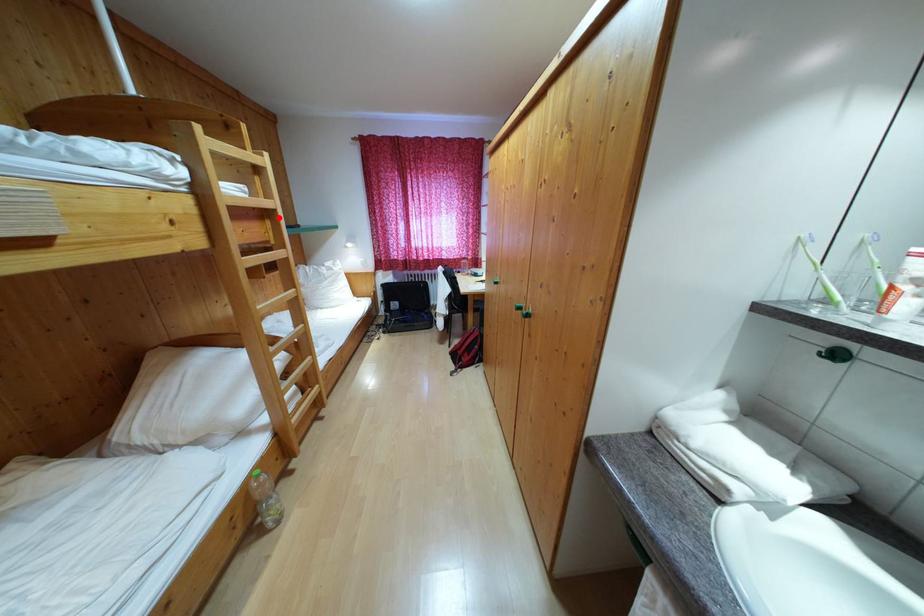
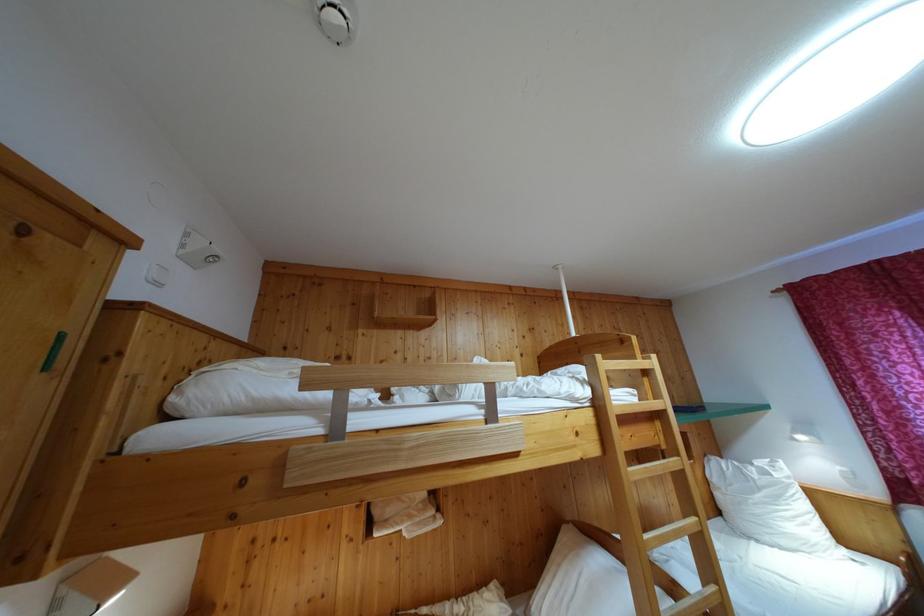
Question: I am providing you with two images of the same scene from different viewpoints. Given a red point in image1, look at the same physical point in image2. Is it:

Choices:
 (A) Closer to the viewpoint
 (B) Farther from the viewpoint

Answer: (B)